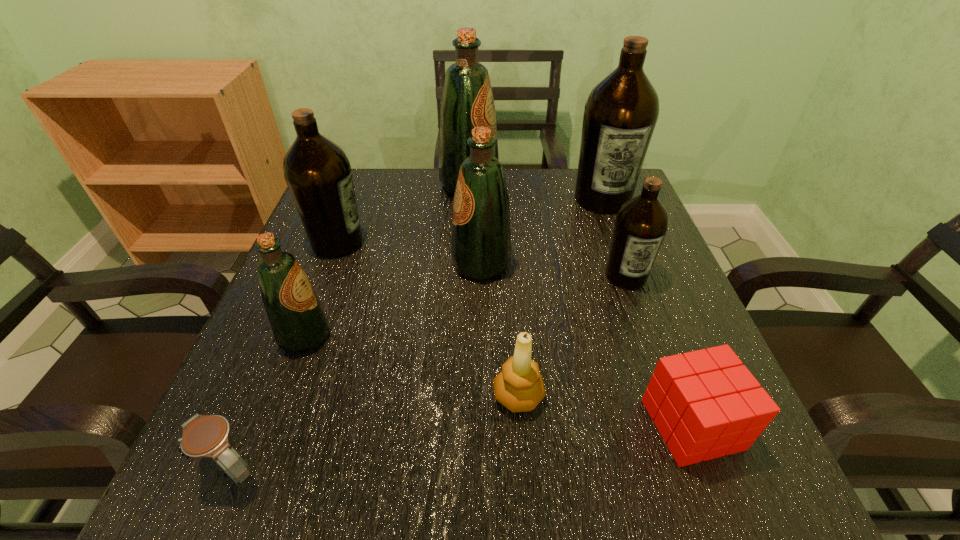
Where is `watch`? The image size is (960, 540). watch is located at coordinates (204, 436).

I want to click on free space located on the label of the farthest brown olive oil, so click(631, 276).

Identify the location of free space located on the front-facing side of the biggest green olive oil. (619, 186).

The height and width of the screenshot is (540, 960). Find the location of `free location located 0.050m on the front-facing side of the second biggest green olive oil`. free location located 0.050m on the front-facing side of the second biggest green olive oil is located at coordinates (428, 264).

Find the location of a particular element. This screenshot has width=960, height=540. free space located 0.110m on the front-facing side of the second biggest green olive oil is located at coordinates (400, 264).

In order to click on vacant area located 0.190m on the front-facing side of the second biggest green olive oil in this screenshot , I will do `click(363, 264)`.

Find the location of a particular element. The height and width of the screenshot is (540, 960). free region located on the label of the second farthest brown olive oil is located at coordinates (388, 242).

Find the location of a particular element. The image size is (960, 540). free region located on the front-facing side of the nearest green olive oil is located at coordinates (458, 336).

Where is `vacant region located 0.060m on the label of the smallest brown olive oil`? vacant region located 0.060m on the label of the smallest brown olive oil is located at coordinates (639, 314).

Identify the location of free space located on the back of the third shortest object. The image size is (960, 540). point(507,235).